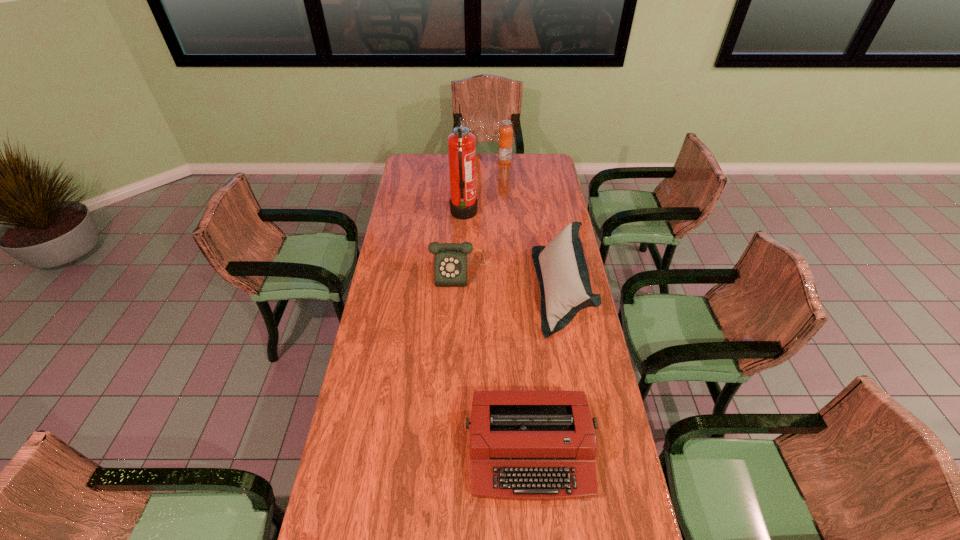
Find the location of a particular element. The image size is (960, 540). free space between the third tallest object and the typewriter is located at coordinates point(545,372).

The width and height of the screenshot is (960, 540). I want to click on empty location between the cushion and the fire extinguisher, so click(512, 253).

Locate an element on the screen. The width and height of the screenshot is (960, 540). free space between the farthest object and the nearest object is located at coordinates (517, 307).

Identify the location of unoccupied area between the telephone and the fruit juice. (484, 217).

Image resolution: width=960 pixels, height=540 pixels. What are the coordinates of `empty space between the telephone and the typewriter` in the screenshot? It's located at (496, 362).

Image resolution: width=960 pixels, height=540 pixels. I want to click on vacant space that's between the second tallest object and the cushion, so click(533, 226).

Where is `the closest object to the fourth shortest object`? the closest object to the fourth shortest object is located at coordinates (463, 203).

Find the location of a particular element. Image resolution: width=960 pixels, height=540 pixels. object that is the closest one to the nearest object is located at coordinates (561, 268).